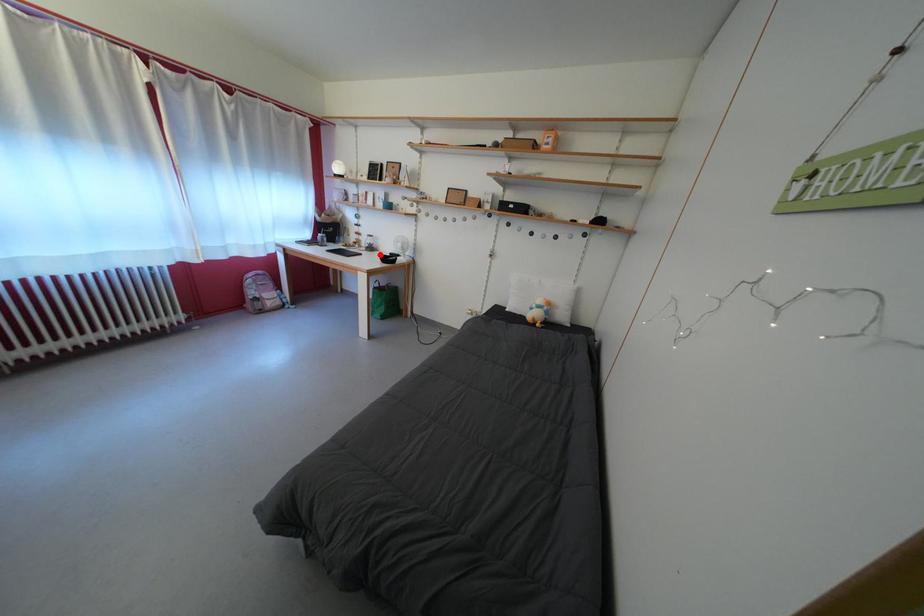
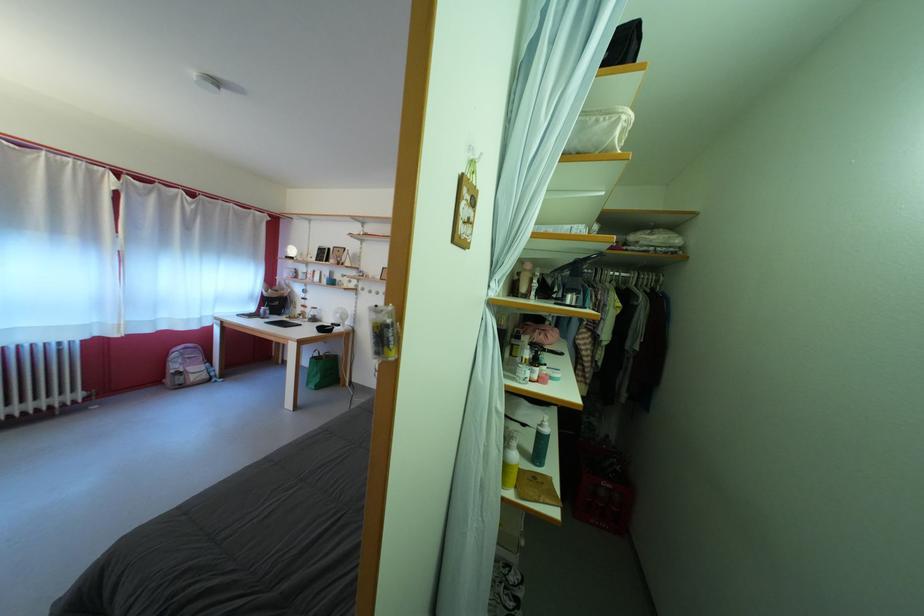
Where in the second image is the point corresponding to the highlighted location from the first image?

(322, 325)